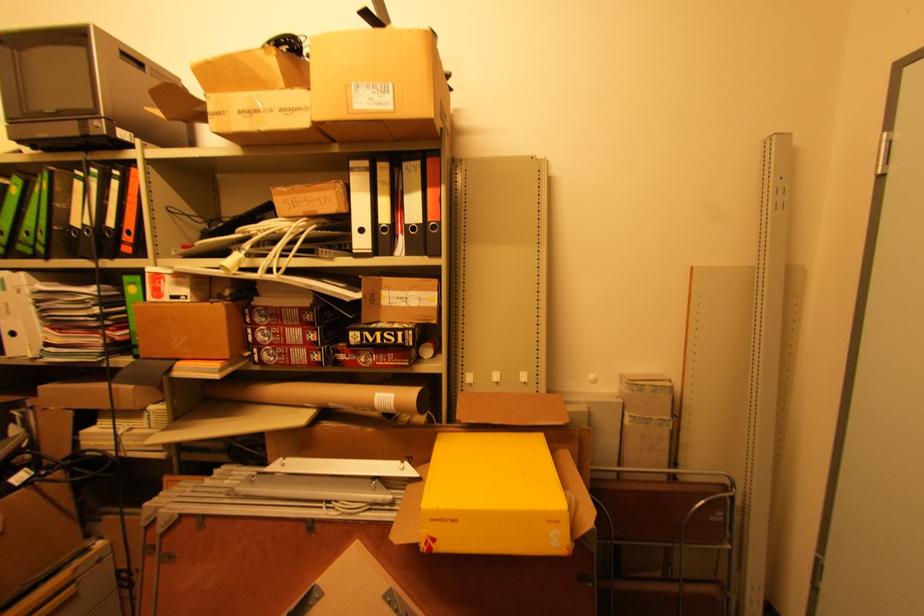
At what (x,y) coordinates should I click in order to perform the action: click on yellow cardboard box. Please return your answer as a coordinate pair (x, y). Looking at the image, I should click on (493, 496).